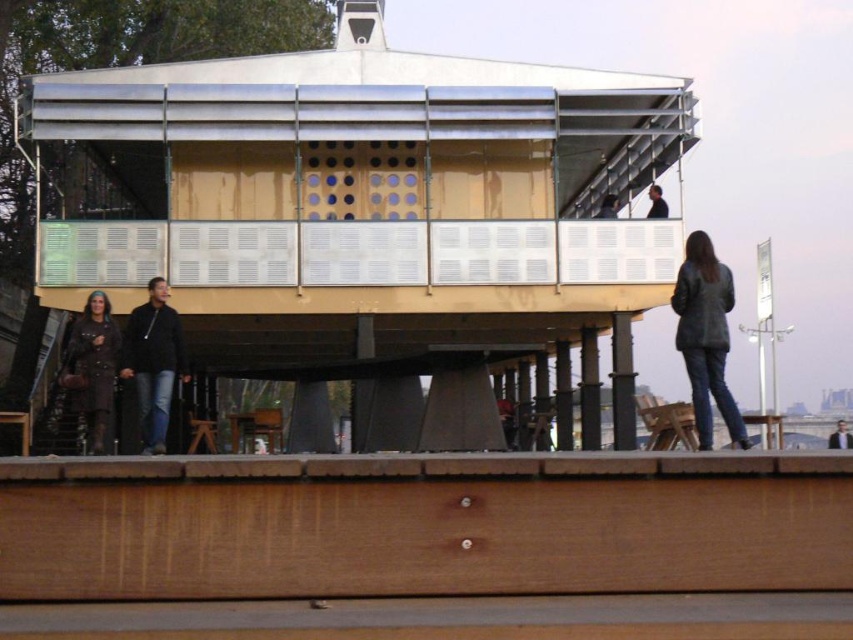
Describe the element at coordinates (706, 337) in the screenshot. The height and width of the screenshot is (640, 853). I see `leather jacket at right` at that location.

Can you confirm if leather jacket at right is positioned to the right of black leather jacket at upper right?

No, leather jacket at right is not to the right of black leather jacket at upper right.

Where is `leather jacket at right`? This screenshot has height=640, width=853. leather jacket at right is located at coordinates (706, 337).

From the picture: Is brown leather coat at lower left further to camera compared to black leather jacket at upper right?

No, brown leather coat at lower left is in front of black leather jacket at upper right.

What do you see at coordinates (91, 368) in the screenshot? I see `brown leather coat at lower left` at bounding box center [91, 368].

Which is behind, point (82, 376) or point (665, 216)?

Point (665, 216)

Locate an element on the screen. This screenshot has height=640, width=853. brown leather coat at lower left is located at coordinates (91, 368).

The image size is (853, 640). I want to click on black leather jacket at lower left, so click(154, 362).

Is black leather jacket at lower left behind dark gray leather jacket at upper right?

No.

Is point (148, 298) farther from camera compared to point (833, 436)?

No, (148, 298) is in front of (833, 436).

This screenshot has height=640, width=853. Find the location of `black leather jacket at lower left`. black leather jacket at lower left is located at coordinates (154, 362).